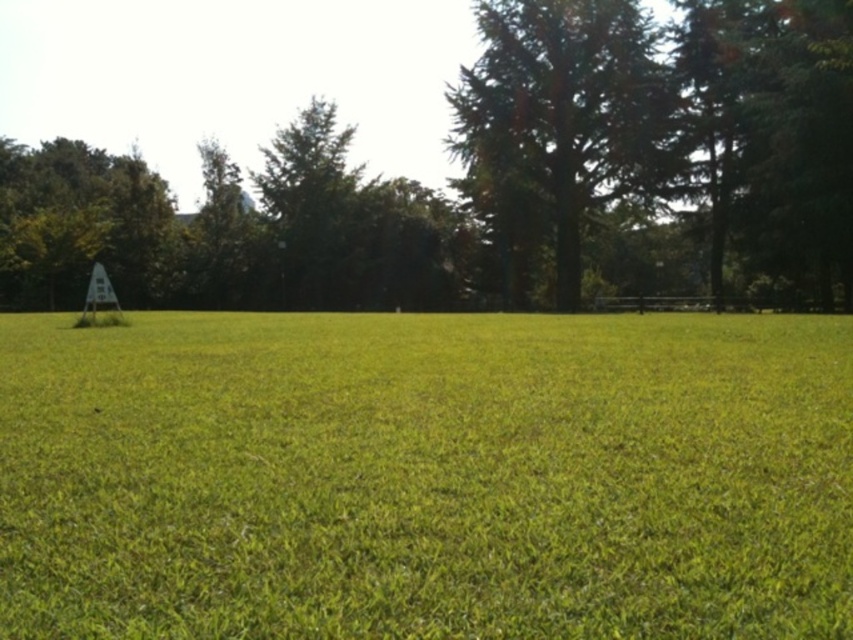
Question: Is green leafy tree at center above green textured tree at upper right?

Choices:
 (A) yes
 (B) no

Answer: (A)

Question: Which point is farther to the camera?

Choices:
 (A) green leafy tree at center
 (B) green grass at center
 (C) green textured tree at upper right

Answer: (C)

Question: Which object appears farthest from the camera in this image?

Choices:
 (A) green grass at center
 (B) green leafy tree at center

Answer: (B)

Question: Among these points, which one is nearest to the camera?

Choices:
 (A) (480, 125)
 (B) (213, 632)
 (C) (590, 266)

Answer: (B)

Question: From the image, what is the correct spatial relationship of green leafy tree at center in relation to green textured tree at upper right?

Choices:
 (A) below
 (B) above

Answer: (B)

Question: From the image, what is the correct spatial relationship of green grass at center in relation to green textured tree at upper right?

Choices:
 (A) left
 (B) right

Answer: (A)